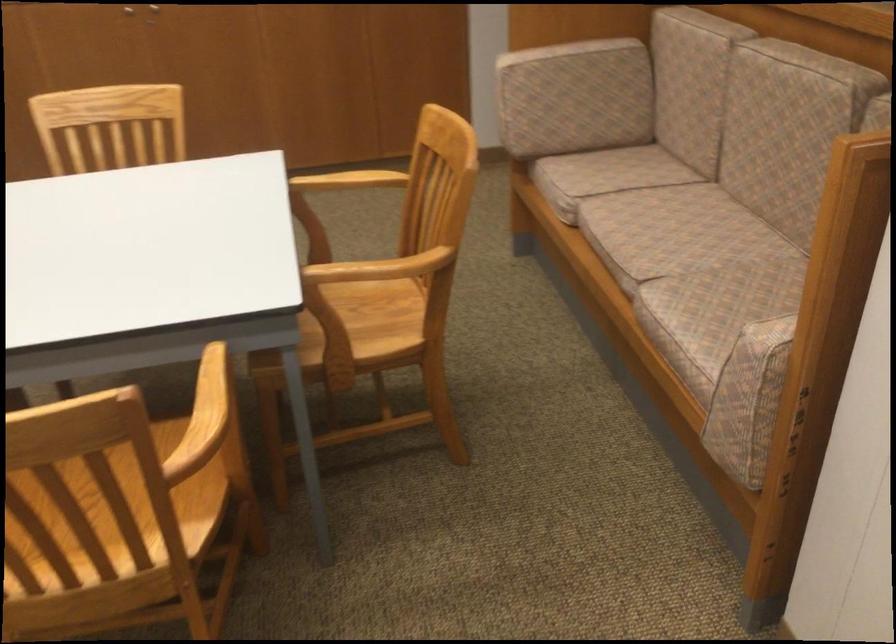
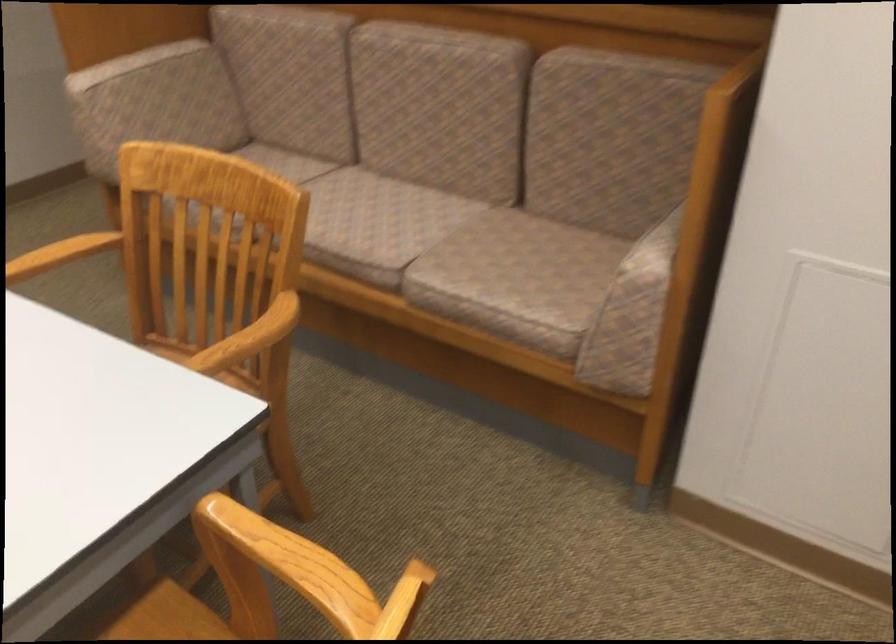
Find the pixel in the second image that matches (799,327) in the first image.

(655, 248)